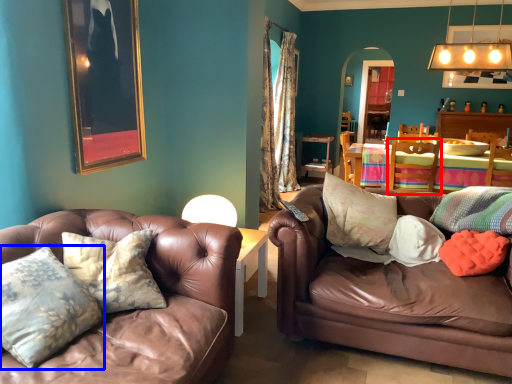
Question: Among these objects, which one is farthest to the camera, chair (highlighted by a red box) or pillow (highlighted by a blue box)?

Choices:
 (A) chair
 (B) pillow

Answer: (A)